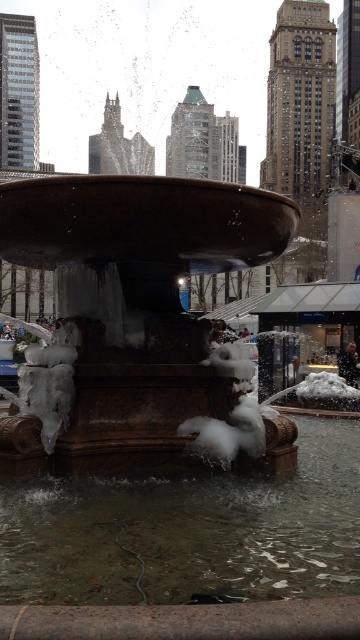
Question: Which object appears farthest from the camera in this image?

Choices:
 (A) bronze stone fountain at center
 (B) clear water at fountain center

Answer: (A)

Question: Does bronze stone fountain at center lie in front of clear water at fountain center?

Choices:
 (A) no
 (B) yes

Answer: (A)

Question: Can you confirm if bronze stone fountain at center is positioned to the right of clear water at fountain center?

Choices:
 (A) no
 (B) yes

Answer: (A)

Question: Does bronze stone fountain at center have a lesser width compared to clear water at fountain center?

Choices:
 (A) no
 (B) yes

Answer: (B)